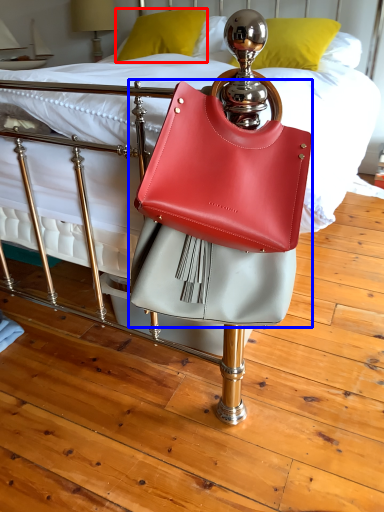
Question: Which object is further to the camera taking this photo, pillow (highlighted by a red box) or handbag (highlighted by a blue box)?

Choices:
 (A) pillow
 (B) handbag

Answer: (A)